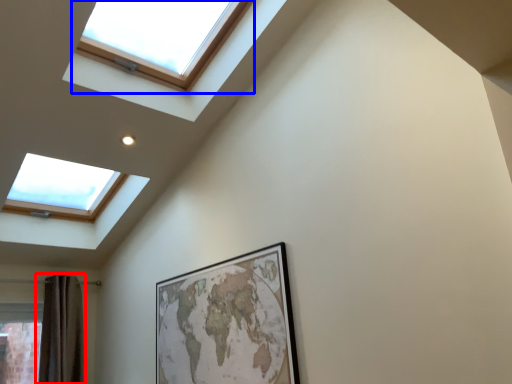
Question: Which point is further to the camera, shower curtain (highlighted by a red box) or window (highlighted by a blue box)?

Choices:
 (A) shower curtain
 (B) window

Answer: (A)